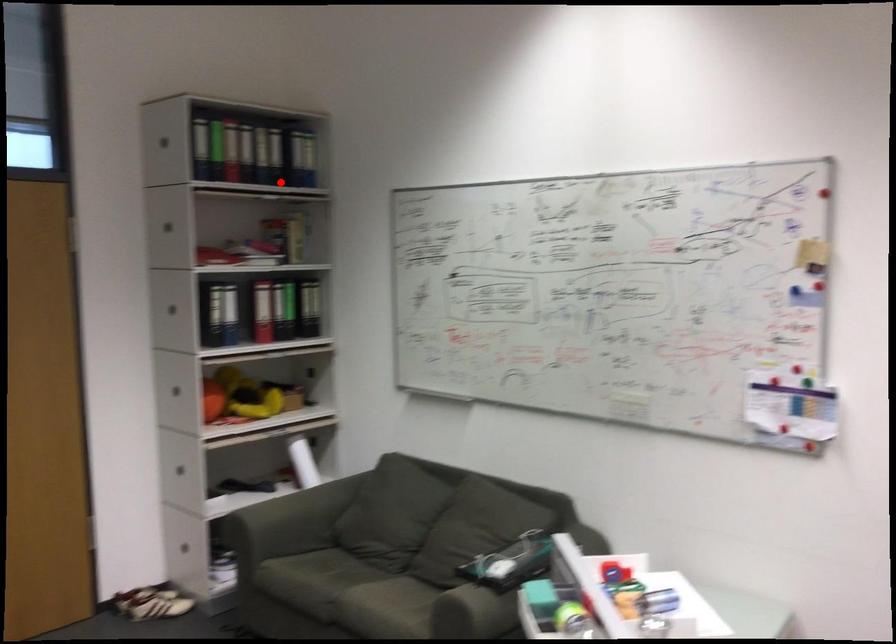
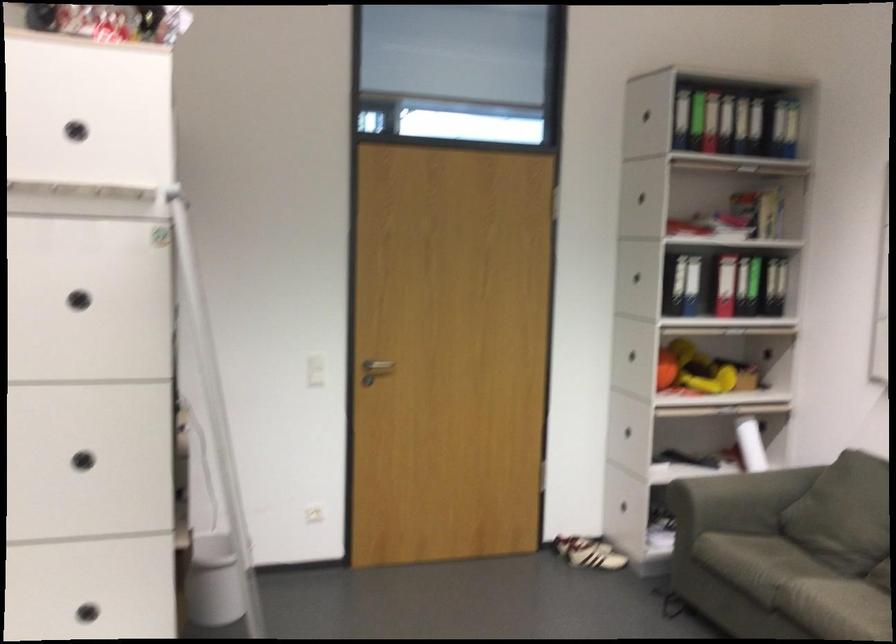
Where in the second image is the point corresponding to the highlighted location from the first image?

(764, 126)